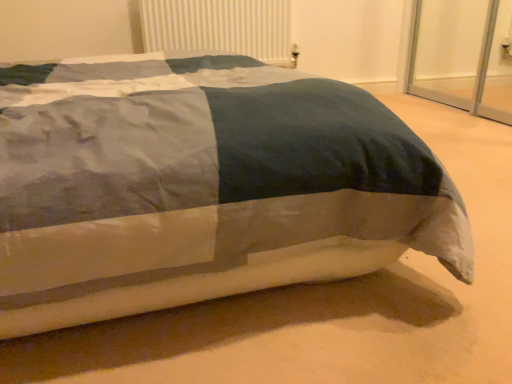
Question: From a real-world perspective, is textured cotton bed at center under white plastic radiator at upper center?

Choices:
 (A) yes
 (B) no

Answer: (A)

Question: From a real-world perspective, is textured cotton bed at center on top of white plastic radiator at upper center?

Choices:
 (A) no
 (B) yes

Answer: (A)

Question: From the image's perspective, is textured cotton bed at center located beneath white plastic radiator at upper center?

Choices:
 (A) yes
 (B) no

Answer: (A)

Question: From the image's perspective, is textured cotton bed at center over white plastic radiator at upper center?

Choices:
 (A) yes
 (B) no

Answer: (B)

Question: Can you confirm if textured cotton bed at center is taller than white plastic radiator at upper center?

Choices:
 (A) no
 (B) yes

Answer: (A)

Question: Does textured cotton bed at center have a larger size compared to white plastic radiator at upper center?

Choices:
 (A) no
 (B) yes

Answer: (B)

Question: Does white plastic radiator at upper center lie behind textured cotton bed at center?

Choices:
 (A) no
 (B) yes

Answer: (B)

Question: Can you confirm if white plastic radiator at upper center is wider than textured cotton bed at center?

Choices:
 (A) yes
 (B) no

Answer: (B)

Question: Is white plastic radiator at upper center shorter than textured cotton bed at center?

Choices:
 (A) no
 (B) yes

Answer: (A)

Question: Can you confirm if white plastic radiator at upper center is bigger than textured cotton bed at center?

Choices:
 (A) no
 (B) yes

Answer: (A)

Question: Is white plastic radiator at upper center positioned with its back to textured cotton bed at center?

Choices:
 (A) no
 (B) yes

Answer: (A)

Question: From a real-world perspective, is white plastic radiator at upper center below textured cotton bed at center?

Choices:
 (A) no
 (B) yes

Answer: (A)

Question: Would you say white plastic radiator at upper center is to the left or to the right of textured cotton bed at center in the picture?

Choices:
 (A) left
 (B) right

Answer: (A)